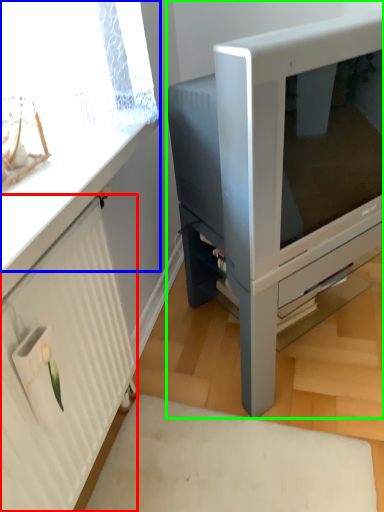
Question: Which object is positioned closest to radiator (highlighted by a red box)? Select from window screen (highlighted by a blue box) and furniture (highlighted by a green box).

Choices:
 (A) window screen
 (B) furniture

Answer: (A)